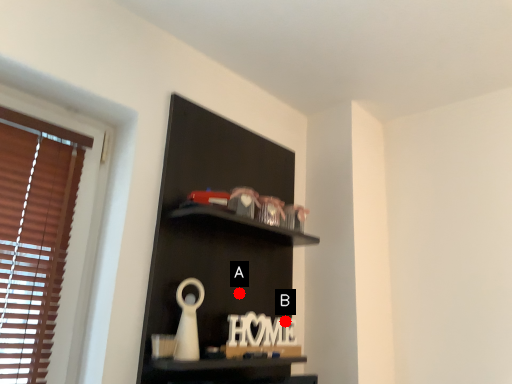
Question: Two points are circled on the image, labeled by A and B beside each circle. Which point is farther from the camera taking this photo?

Choices:
 (A) A is further
 (B) B is further

Answer: (B)